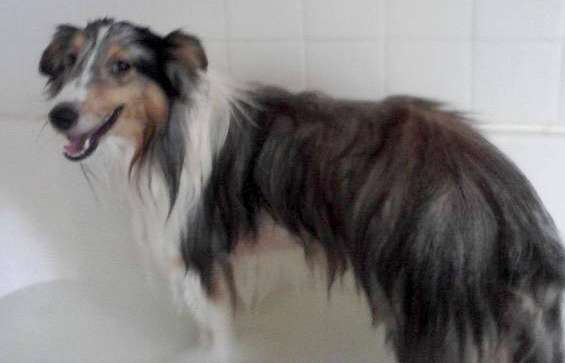
I want to click on bathtub, so click(127, 331), click(330, 321).